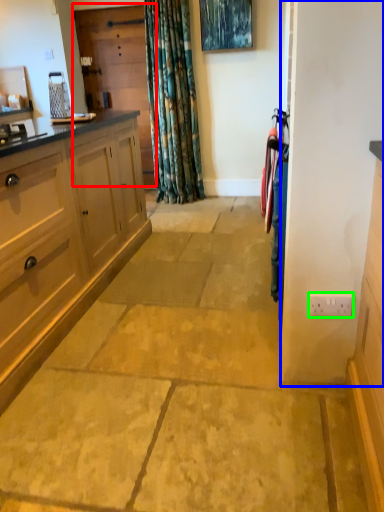
Question: Considering the real-world distances, which object is farthest from screen door (highlighted by a red box)? screen door (highlighted by a blue box) or electric outlet (highlighted by a green box)?

Choices:
 (A) screen door
 (B) electric outlet

Answer: (B)